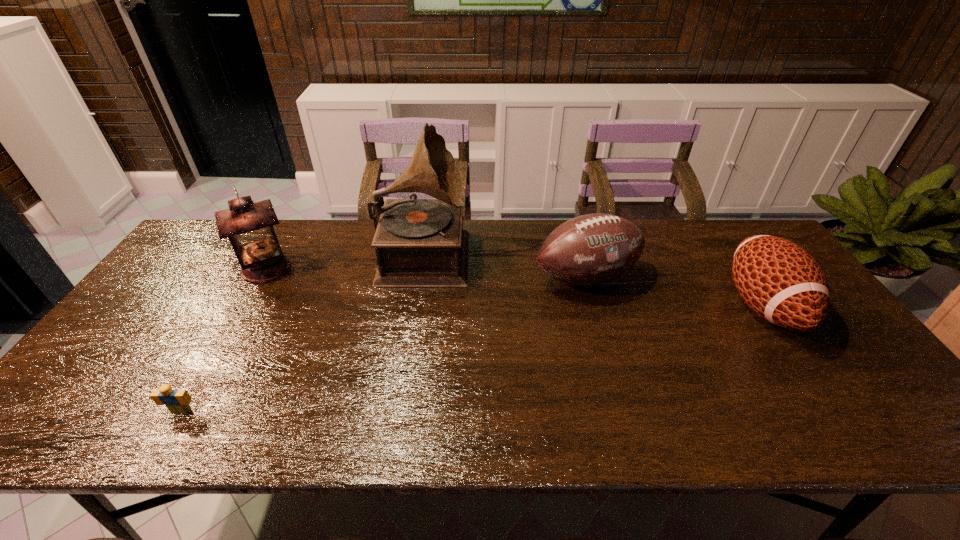
At what (x,y) coordinates should I click in order to perform the action: click on vacant area located 0.060m on the back of the right football. Please return your answer as a coordinate pair (x, y). The width and height of the screenshot is (960, 540). Looking at the image, I should click on (728, 254).

Find the location of a particular element. record player present at the far edge is located at coordinates (418, 242).

The width and height of the screenshot is (960, 540). What are the coordinates of `oil lamp at the far edge` in the screenshot? It's located at (248, 225).

Locate an element on the screen. This screenshot has width=960, height=540. football (American) that is at the far edge is located at coordinates (591, 249).

Where is `object positioned at the near edge`? object positioned at the near edge is located at coordinates (177, 401).

Find the location of a particular element. This screenshot has height=540, width=960. object present at the right edge is located at coordinates (780, 281).

The width and height of the screenshot is (960, 540). Find the location of `vacant space at the far edge`. vacant space at the far edge is located at coordinates (532, 234).

In the image, there is a desktop. Where is `vacant area at the near edge`? vacant area at the near edge is located at coordinates (332, 412).

In the image, there is a desktop. Identify the location of vacant space at the left edge. (129, 364).

Find the location of a particular element. This screenshot has width=960, height=540. free area in between the tallest object and the second object from right to left is located at coordinates (505, 265).